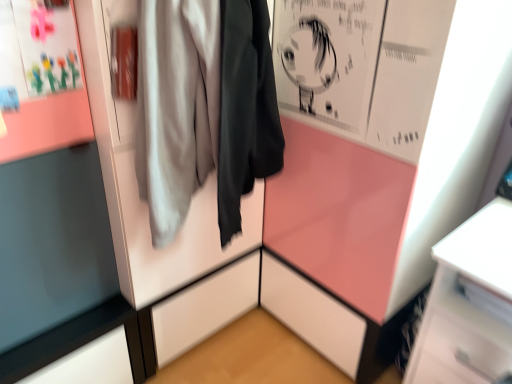
The image size is (512, 384). What do you see at coordinates (204, 108) in the screenshot?
I see `matte gray jacket at center` at bounding box center [204, 108].

Locate an element on the screen. matte gray jacket at center is located at coordinates (204, 108).

You are a GUI agent. You are given a task and a screenshot of the screen. Output one action in this format:
    pyautogui.click(x=<x>, y=<y>)
    Task: Click on the matte paper poster at upper left
    Image resolution: width=512 pixels, height=384 pixels.
    Given the screenshot: What is the action you would take?
    pyautogui.click(x=40, y=80)

This screenshot has width=512, height=384. What do you see at coordinates (40, 80) in the screenshot?
I see `matte paper poster at upper left` at bounding box center [40, 80].

Identify the location of matte gray jacket at center. This screenshot has width=512, height=384. (204, 108).

Looking at this image, in the image, is matte gray jacket at center on the left side or the right side of matte paper poster at upper left?

Based on their positions, matte gray jacket at center is located to the right of matte paper poster at upper left.

Is the position of matte gray jacket at center less distant than that of matte paper poster at upper left?

Yes, matte gray jacket at center is closer to the camera.

Does point (258, 104) come behind point (40, 108)?

Yes, it is behind point (40, 108).

From the image's perspective, between matte gray jacket at center and matte paper poster at upper left, who is located below?

matte gray jacket at center appears lower in the image.

From a real-world perspective, is matte gray jacket at center physically located above or below matte paper poster at upper left?

Clearly, from a real-world perspective, matte gray jacket at center is below matte paper poster at upper left.

Does matte gray jacket at center have a greater width compared to matte paper poster at upper left?

Yes.

Considering the sizes of objects matte gray jacket at center and matte paper poster at upper left in the image provided, who is taller, matte gray jacket at center or matte paper poster at upper left?

matte gray jacket at center.

Is matte gray jacket at center bigger than matte paper poster at upper left?

Yes, matte gray jacket at center is bigger than matte paper poster at upper left.

From the picture: Is matte gray jacket at center spatially inside matte paper poster at upper left, or outside of it?

matte gray jacket at center cannot be found inside matte paper poster at upper left.

Is matte gray jacket at center placed right next to matte paper poster at upper left?

No, matte gray jacket at center is not with matte paper poster at upper left.

Is matte gray jacket at center oriented away from matte paper poster at upper left?

No, matte paper poster at upper left is not at the back of matte gray jacket at center.

Can you tell me how much matte gray jacket at center and matte paper poster at upper left differ in facing direction?

The facing directions of matte gray jacket at center and matte paper poster at upper left are 0.698 degrees apart.

How far apart are matte gray jacket at center and matte paper poster at upper left?

matte gray jacket at center and matte paper poster at upper left are 29.07 centimeters apart.

This screenshot has width=512, height=384. In the image, there is a matte paper poster at upper left. Identify the location of jacket below it (from a real-world perspective). (204, 108).

Considering the relative positions of matte paper poster at upper left and matte gray jacket at center in the image provided, is matte paper poster at upper left to the right of matte gray jacket at center from the viewer's perspective?

Incorrect, matte paper poster at upper left is not on the right side of matte gray jacket at center.

Which object is closer to the camera, matte paper poster at upper left or matte gray jacket at center?

matte gray jacket at center is more forward.

Considering the points (68, 81) and (214, 1), which point is in front, point (68, 81) or point (214, 1)?

The point (214, 1) is more forward.

From the image's perspective, is matte paper poster at upper left under matte gray jacket at center?

No.

Based on the photo, from a real-world perspective, who is located higher, matte paper poster at upper left or matte gray jacket at center?

matte paper poster at upper left, from a real-world perspective.

Does matte paper poster at upper left have a lesser width compared to matte gray jacket at center?

Yes.

Between matte paper poster at upper left and matte gray jacket at center, which one has more height?

matte gray jacket at center.

Which of these two, matte paper poster at upper left or matte gray jacket at center, is bigger?

matte gray jacket at center.

From the picture: Is matte paper poster at upper left inside or outside of matte gray jacket at center?

matte paper poster at upper left is not enclosed by matte gray jacket at center.

Is matte paper poster at upper left touching matte gray jacket at center?

matte paper poster at upper left and matte gray jacket at center are clearly separated.

Is matte paper poster at upper left positioned with its back to matte gray jacket at center?

matte paper poster at upper left is not turned away from matte gray jacket at center.

What's the angular difference between matte paper poster at upper left and matte gray jacket at center's facing directions?

The angle between the facing direction of matte paper poster at upper left and the facing direction of matte gray jacket at center is 0.698 degrees.

How far apart are matte paper poster at upper left and matte gray jacket at center?

29.07 centimeters.

Where is `jacket located underneath the matte paper poster at upper left (from a real-world perspective)`? The image size is (512, 384). jacket located underneath the matte paper poster at upper left (from a real-world perspective) is located at coordinates (204, 108).

Identify the location of jacket that appears in front of the matte paper poster at upper left. (204, 108).

In the image, there is a matte gray jacket at center. Identify the location of poster page above it (from the image's perspective). (40, 80).